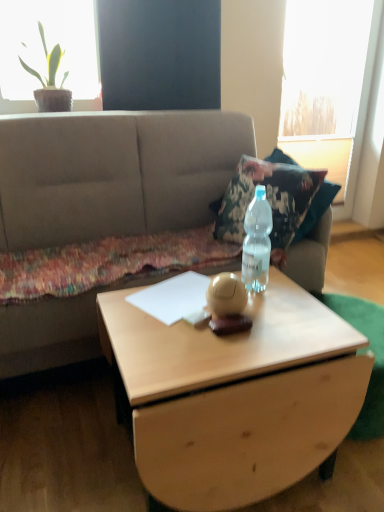
You are a GUI agent. You are given a task and a screenshot of the screen. Output one action in this format:
    pyautogui.click(x=<x>, y=<y>)
    Task: Click on the vacant area that is in front of clear plastic bottle at center
    
    Given the screenshot: What is the action you would take?
    pyautogui.click(x=283, y=313)